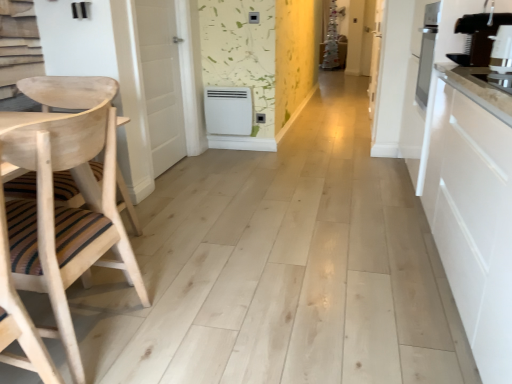
Find the location of a particular element. The image size is (512, 384). free point below white smooth door at left, which appears as the first door when viewed from the left (from a real-world perspective) is located at coordinates (165, 171).